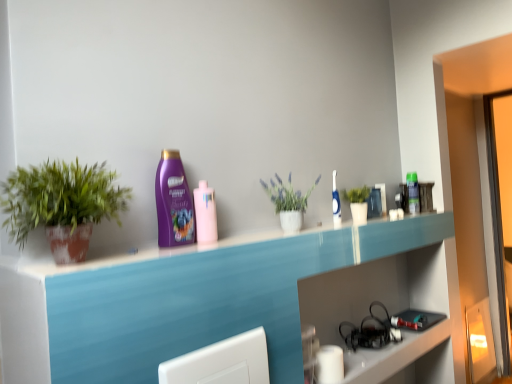
Question: Can you confirm if green matte plant at left, the 3th houseplant in the back-to-front sequence, is shorter than pink glossy mouthwash at center, placed as the 1th mouthwash when sorted from left to right?

Choices:
 (A) no
 (B) yes

Answer: (A)

Question: Is green matte plant at left, the 3th houseplant in the back-to-front sequence, closer to camera compared to pink glossy mouthwash at center, which is counted as the third mouthwash, starting from the right?

Choices:
 (A) no
 (B) yes

Answer: (B)

Question: Considering the relative sizes of green matte plant at left, arranged as the first houseplant when viewed from the left, and pink glossy mouthwash at center, the third mouthwash from the back, in the image provided, is green matte plant at left, arranged as the first houseplant when viewed from the left, wider than pink glossy mouthwash at center, the third mouthwash from the back,?

Choices:
 (A) yes
 (B) no

Answer: (A)

Question: Can you confirm if green matte plant at left, acting as the first houseplant starting from the front, is thinner than pink glossy mouthwash at center, placed as the 1th mouthwash when sorted from left to right?

Choices:
 (A) no
 (B) yes

Answer: (A)

Question: From the image's perspective, is green matte plant at left, arranged as the first houseplant when viewed from the left, located beneath pink glossy mouthwash at center, positioned as the first mouthwash in front-to-back order?

Choices:
 (A) yes
 (B) no

Answer: (B)

Question: From the image's perspective, is green plastic bottle at upper right, which is the 1th mouthwash in back-to-front order, located above or below green matte plant at upper right, placed as the 1th houseplant when sorted from right to left?

Choices:
 (A) below
 (B) above

Answer: (B)

Question: Which is correct: green plastic bottle at upper right, arranged as the first mouthwash when viewed from the right, is inside green matte plant at upper right, placed as the 1th houseplant when sorted from right to left, or outside of it?

Choices:
 (A) inside
 (B) outside

Answer: (B)

Question: In the image, is green plastic bottle at upper right, arranged as the first mouthwash when viewed from the right, on the left side or the right side of green matte plant at upper right, which is the 1th houseplant in back-to-front order?

Choices:
 (A) left
 (B) right

Answer: (B)

Question: From their relative heights in the image, would you say green plastic bottle at upper right, arranged as the first mouthwash when viewed from the right, is taller or shorter than green matte plant at upper right, marked as the 3th houseplant in a front-to-back arrangement?

Choices:
 (A) short
 (B) tall

Answer: (B)

Question: Would you say green matte plant at upper right, which is counted as the 3th houseplant, starting from the left, is to the left or to the right of purple glossy shampoo at center in the picture?

Choices:
 (A) right
 (B) left

Answer: (A)

Question: Considering the positions of green matte plant at upper right, marked as the 3th houseplant in a front-to-back arrangement, and purple glossy shampoo at center in the image, is green matte plant at upper right, marked as the 3th houseplant in a front-to-back arrangement, bigger or smaller than purple glossy shampoo at center?

Choices:
 (A) small
 (B) big

Answer: (B)

Question: From a real-world perspective, relative to purple glossy shampoo at center, is green matte plant at upper right, which is the 1th houseplant in back-to-front order, vertically above or below?

Choices:
 (A) below
 (B) above

Answer: (A)

Question: Is green matte plant at upper right, which is counted as the 3th houseplant, starting from the left, in front of or behind purple glossy shampoo at center in the image?

Choices:
 (A) front
 (B) behind

Answer: (B)

Question: Considering the positions of white matte vase at center, the 2th houseplant viewed from the front, and green matte plant at left, arranged as the first houseplant when viewed from the left, in the image, is white matte vase at center, the 2th houseplant viewed from the front, taller or shorter than green matte plant at left, arranged as the first houseplant when viewed from the left,?

Choices:
 (A) short
 (B) tall

Answer: (A)

Question: From the image's perspective, is white matte vase at center, which is the second houseplant from back to front, above or below green matte plant at left, the 3th houseplant in the back-to-front sequence?

Choices:
 (A) below
 (B) above

Answer: (B)